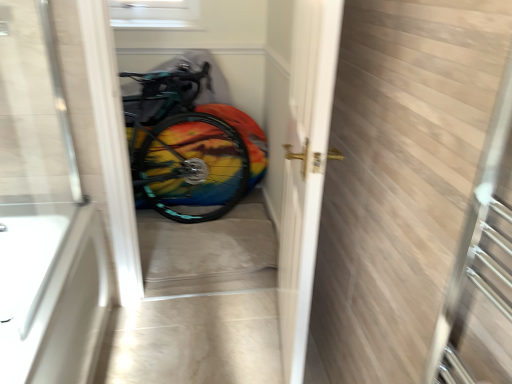
Question: Is rainbow painted bicycle at center thinner than white glossy door handle at center?

Choices:
 (A) no
 (B) yes

Answer: (B)

Question: Are rainbow painted bicycle at center and white glossy door handle at center beside each other?

Choices:
 (A) no
 (B) yes

Answer: (A)

Question: Is rainbow painted bicycle at center smaller than white glossy door handle at center?

Choices:
 (A) yes
 (B) no

Answer: (A)

Question: Considering the relative sizes of rainbow painted bicycle at center and white glossy door handle at center in the image provided, is rainbow painted bicycle at center wider than white glossy door handle at center?

Choices:
 (A) yes
 (B) no

Answer: (B)

Question: Is rainbow painted bicycle at center facing away from white glossy door handle at center?

Choices:
 (A) no
 (B) yes

Answer: (A)

Question: Is rainbow painted bicycle at center to the left of white glossy door handle at center from the viewer's perspective?

Choices:
 (A) yes
 (B) no

Answer: (A)

Question: From the image's perspective, is multicolored fabric at center above white glossy bathtub at lower left?

Choices:
 (A) no
 (B) yes

Answer: (B)

Question: Can you confirm if multicolored fabric at center is shorter than white glossy bathtub at lower left?

Choices:
 (A) yes
 (B) no

Answer: (A)

Question: Is multicolored fabric at center aimed at white glossy bathtub at lower left?

Choices:
 (A) yes
 (B) no

Answer: (B)

Question: Is the depth of multicolored fabric at center less than that of white glossy bathtub at lower left?

Choices:
 (A) yes
 (B) no

Answer: (B)

Question: From a real-world perspective, is multicolored fabric at center located beneath white glossy bathtub at lower left?

Choices:
 (A) no
 (B) yes

Answer: (B)

Question: Is multicolored fabric at center far away from white glossy bathtub at lower left?

Choices:
 (A) no
 (B) yes

Answer: (A)

Question: Is multicolored fabric at center oriented away from rainbow painted bicycle at center?

Choices:
 (A) yes
 (B) no

Answer: (A)